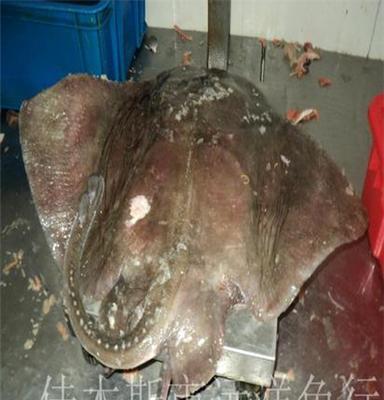
At what (x,y) coordinates should I click in order to perform the action: click on blue bucket. Please return your answer as a coordinate pair (x, y). Looking at the image, I should click on (71, 47).